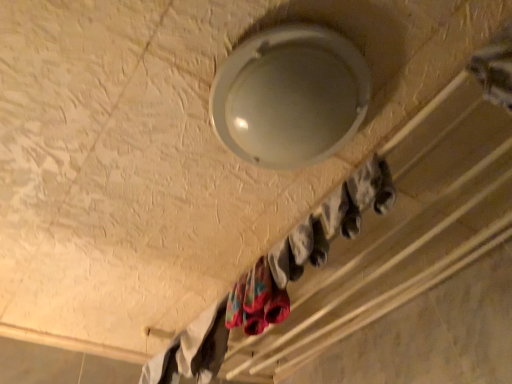
Question: Which direction should I rotate to look at multicolored fabric socks at lower center, which is the second clothing from left to right?

Choices:
 (A) right
 (B) left

Answer: (B)

Question: From the image's perspective, is multicolored fabric socks at lower center, the first clothing from the top, below white cotton socks at lower left, arranged as the second clothing when viewed from the right?

Choices:
 (A) yes
 (B) no

Answer: (B)

Question: Does multicolored fabric socks at lower center, the first clothing from the top, have a lesser height compared to white cotton socks at lower left, which is the 2th clothing from front to back?

Choices:
 (A) yes
 (B) no

Answer: (B)

Question: Is white cotton socks at lower left, which is the first clothing in left-to-right order, located within multicolored fabric socks at lower center, the 1th clothing viewed from the front?

Choices:
 (A) yes
 (B) no

Answer: (B)

Question: From a real-world perspective, is multicolored fabric socks at lower center, the first clothing from the top, positioned over white cotton socks at lower left, which is the first clothing in left-to-right order, based on gravity?

Choices:
 (A) yes
 (B) no

Answer: (B)

Question: Are multicolored fabric socks at lower center, the 1th clothing viewed from the front, and white cotton socks at lower left, the first clothing positioned from the bottom, beside each other?

Choices:
 (A) yes
 (B) no

Answer: (B)

Question: Could you tell me if multicolored fabric socks at lower center, which is the second clothing from left to right, is turned towards white cotton socks at lower left, which is the first clothing in left-to-right order?

Choices:
 (A) no
 (B) yes

Answer: (A)

Question: Could you tell me if white cotton socks at lower left, which is the 2th clothing from front to back, is turned towards white matte socks at upper center?

Choices:
 (A) no
 (B) yes

Answer: (A)

Question: Does white cotton socks at lower left, which is the first clothing in left-to-right order, appear on the right side of white matte socks at upper center?

Choices:
 (A) yes
 (B) no

Answer: (B)

Question: Considering the relative sizes of white cotton socks at lower left, arranged as the first clothing when viewed from the back, and white matte socks at upper center in the image provided, is white cotton socks at lower left, arranged as the first clothing when viewed from the back, smaller than white matte socks at upper center?

Choices:
 (A) yes
 (B) no

Answer: (A)

Question: Is white matte socks at upper center a part of white cotton socks at lower left, which is the 2th clothing from front to back?

Choices:
 (A) no
 (B) yes

Answer: (A)

Question: Is white cotton socks at lower left, which is the first clothing in left-to-right order, placed right next to white matte socks at upper center?

Choices:
 (A) no
 (B) yes

Answer: (A)

Question: From the image's perspective, is white cotton socks at lower left, which is the first clothing in left-to-right order, beneath white matte socks at upper center?

Choices:
 (A) yes
 (B) no

Answer: (A)

Question: Are white cotton socks at lower left, arranged as the second clothing when viewed from the right, and multicolored fabric socks at lower center, acting as the 1th clothing starting from the right, far apart?

Choices:
 (A) no
 (B) yes

Answer: (A)